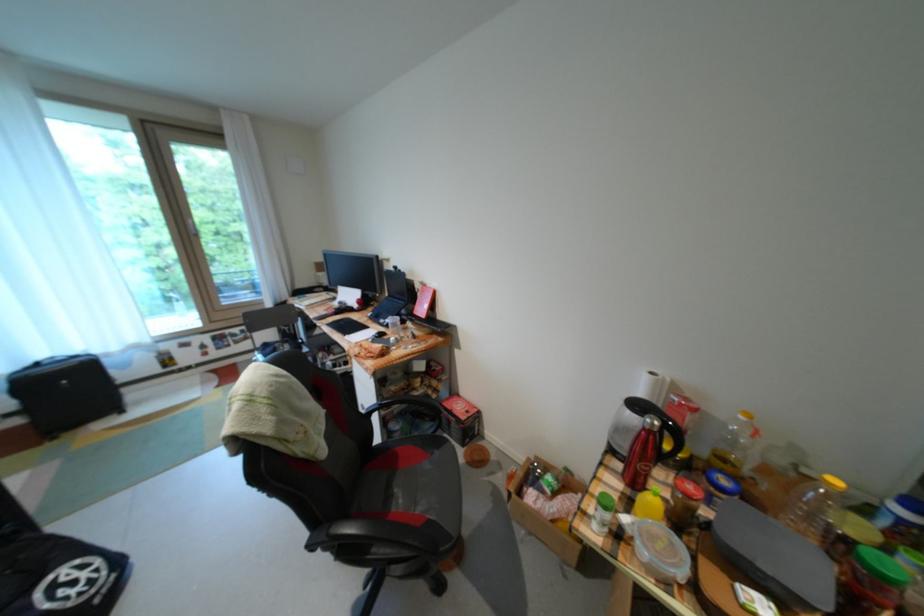
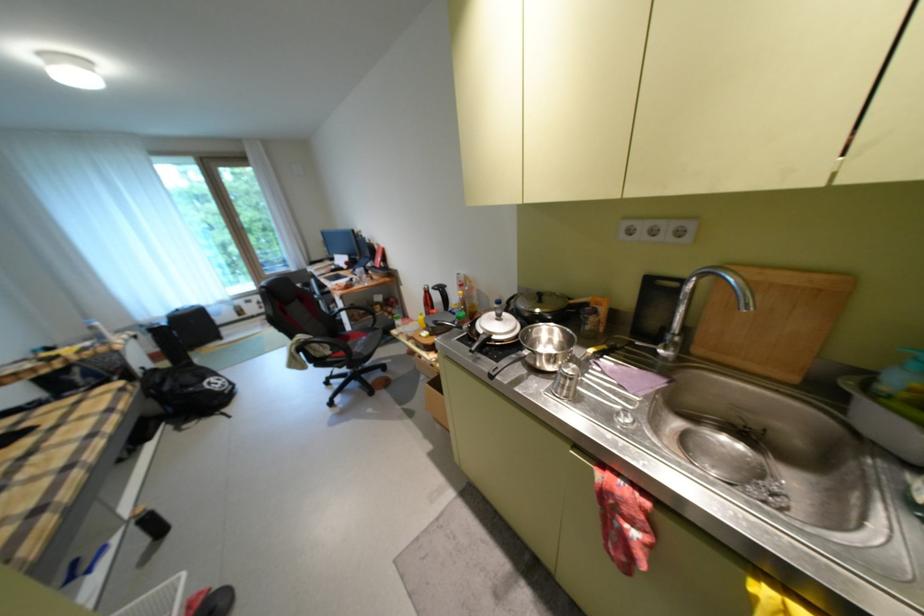
From the picture: Which direction would the cameraman need to move to produce the second image?

The movement direction of the cameraman is right, backward.